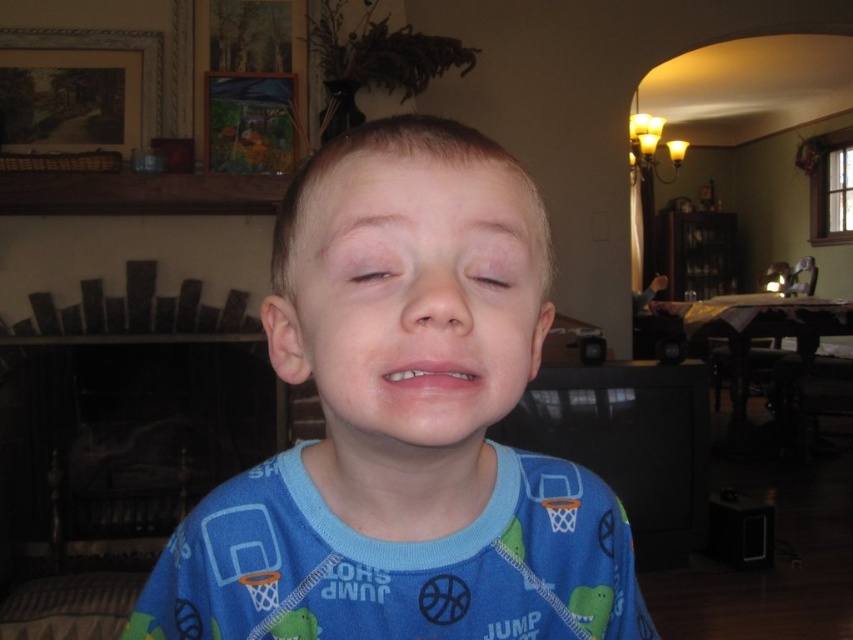
Consider the image. You are designing a custom frame for the child in the scene. The frame needs to accommodate both the blue cotton shirt at center and the light brown skin at center. Which object requires a wider frame due to its greater width?

The blue cotton shirt at center requires a wider frame because its width is larger than the light brown skin at center.

You are a makeup artist observing the child in the scene. You need to apply lipstick to the pink matte lips at center and foundation to the matte skin at center. Which feature requires a larger brush size for application?

The pink matte lips at center requires a larger brush size because it is taller than the matte skin at center, necessitating a brush that can cover the larger area.

You are a photographer trying to capture a closeup of the child in this scene. You want to focus on the blue cotton shirt at center and the light brown skin at center. Which object should you adjust your camera to focus on first if you want to ensure both are in focus?

The blue cotton shirt at center is closer to the viewer than the light brown skin at center, so you should focus on the blue cotton shirt at center first to ensure both are in focus.